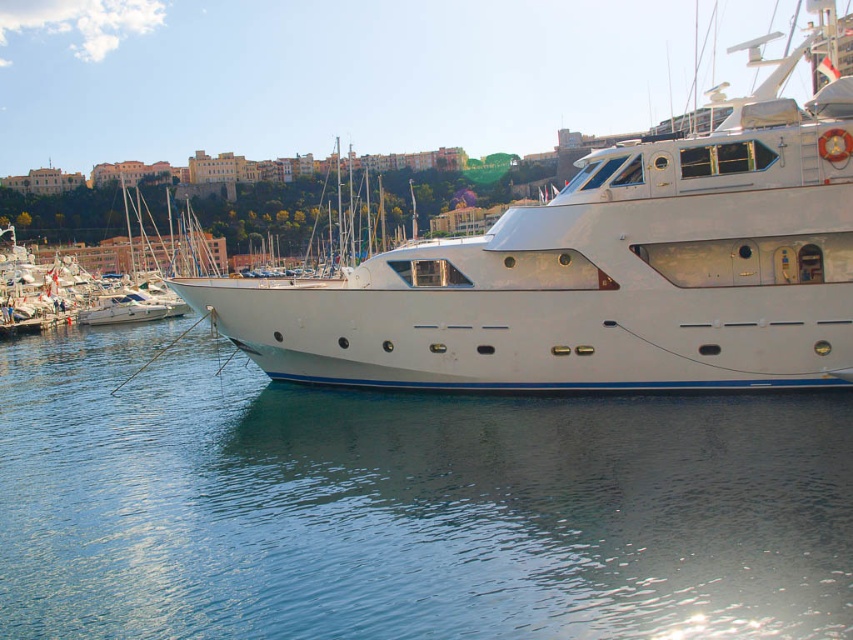
You are standing on the deck of the yacht and notice two points marked on the yacht. The first point is at coordinate point (624, 536) and the second is at point (519, 337). If you want to move from the first point to the second point, which direction should you move relative to the yacht?

Since point (624, 536) is in front of point (519, 337), you should move backward towards the stern of the yacht to reach the second point.

You are standing on the deck of the yacht and want to locate the clear blue water at lower center. According to the coordinates provided, where exactly should you look to find it?

The clear blue water at lower center is located at the coordinates point (x=405, y=506).

You are standing on the dock and see the clear blue water at lower center and the white glossy yacht at center. Which object is located below the other?

The clear blue water at lower center is positioned under the white glossy yacht at center, so the water is below the yacht.